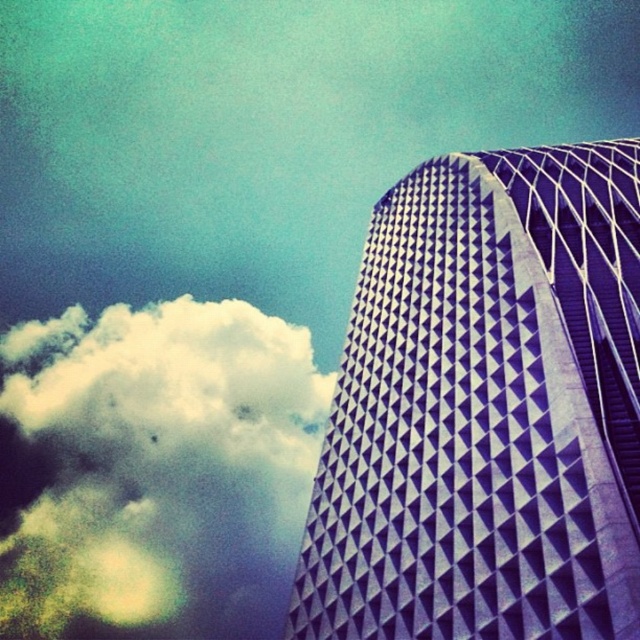
Based on the photo, you are an architect analyzing the spatial relationship between the purple textured building at right and the white fluffy cloud at upper left. Based on the scene, which object is positioned closer to the observer?

The purple textured building at right is closer to the observer than the white fluffy cloud at upper left.

You are an architect evaluating the image of a modern building. You notice the purple textured building at right and the white fluffy cloud at upper left. Which object is shorter in height?

The purple textured building at right has a lesser height compared to the white fluffy cloud at upper left, so the purple textured building at right is shorter.